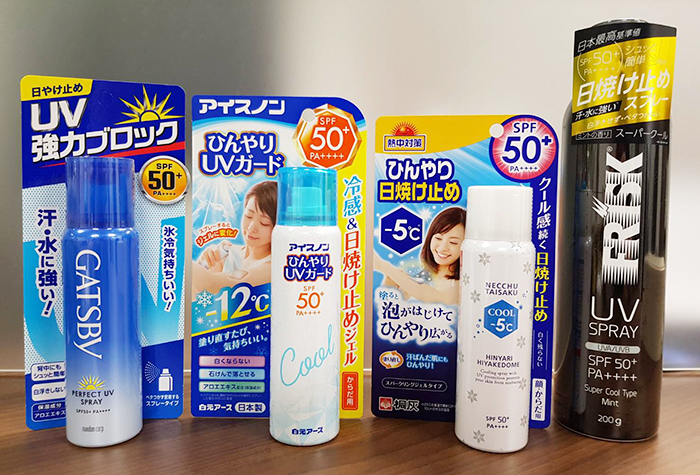
Where is `wood table`? The height and width of the screenshot is (475, 700). wood table is located at coordinates [400, 455].